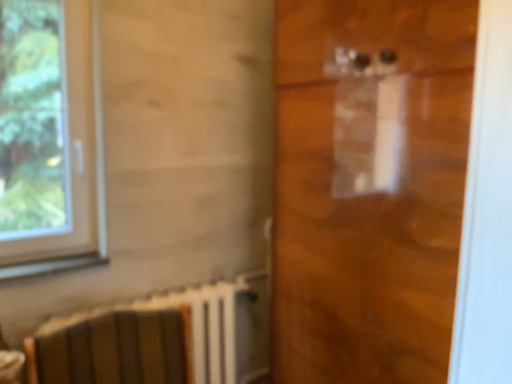
Question: From the image's perspective, would you say matte brown table at lower left is shown under wooden armchair at lower left?

Choices:
 (A) yes
 (B) no

Answer: (B)

Question: Can you confirm if matte brown table at lower left is taller than wooden armchair at lower left?

Choices:
 (A) yes
 (B) no

Answer: (B)

Question: From the image's perspective, is matte brown table at lower left above wooden armchair at lower left?

Choices:
 (A) yes
 (B) no

Answer: (A)

Question: Is matte brown table at lower left behind wooden armchair at lower left?

Choices:
 (A) yes
 (B) no

Answer: (A)

Question: Can you confirm if matte brown table at lower left is wider than wooden armchair at lower left?

Choices:
 (A) yes
 (B) no

Answer: (B)

Question: Is white plastic window at left taller or shorter than matte brown table at lower left?

Choices:
 (A) short
 (B) tall

Answer: (B)

Question: In terms of size, does white plastic window at left appear bigger or smaller than matte brown table at lower left?

Choices:
 (A) small
 (B) big

Answer: (B)

Question: Looking at their shapes, would you say white plastic window at left is wider or thinner than matte brown table at lower left?

Choices:
 (A) thin
 (B) wide

Answer: (A)

Question: From a real-world perspective, is white plastic window at left positioned above or below matte brown table at lower left?

Choices:
 (A) above
 (B) below

Answer: (A)

Question: Based on their sizes in the image, would you say white plastic window at left is bigger or smaller than transparent plastic door at center?

Choices:
 (A) small
 (B) big

Answer: (A)

Question: From their relative heights in the image, would you say white plastic window at left is taller or shorter than transparent plastic door at center?

Choices:
 (A) tall
 (B) short

Answer: (B)

Question: Looking at their shapes, would you say white plastic window at left is wider or thinner than transparent plastic door at center?

Choices:
 (A) thin
 (B) wide

Answer: (A)

Question: Relative to transparent plastic door at center, is white plastic window at left in front or behind?

Choices:
 (A) front
 (B) behind

Answer: (B)

Question: Considering the positions of transparent plastic door at center and wooden armchair at lower left in the image, is transparent plastic door at center wider or thinner than wooden armchair at lower left?

Choices:
 (A) thin
 (B) wide

Answer: (A)

Question: From the image's perspective, is transparent plastic door at center located above or below wooden armchair at lower left?

Choices:
 (A) above
 (B) below

Answer: (A)